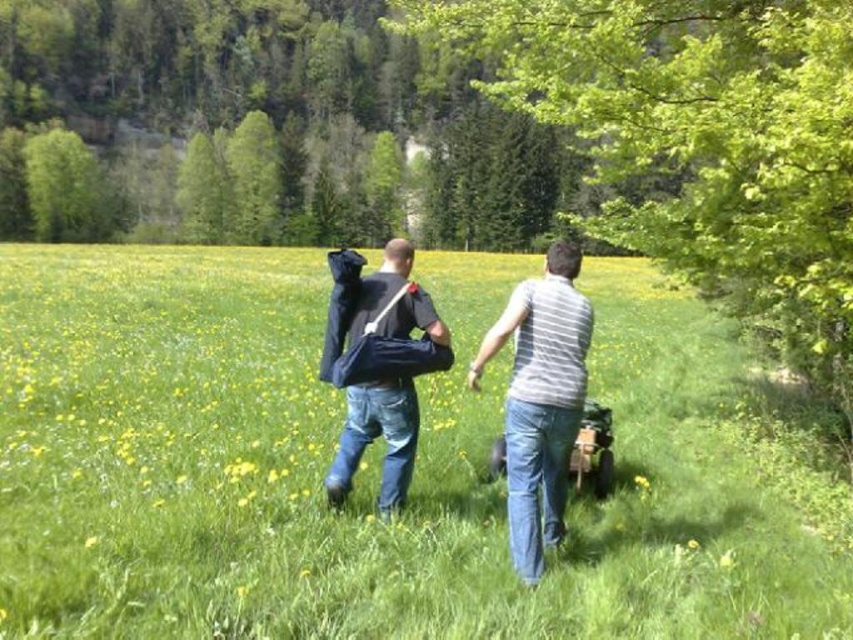
You are a drone operator trying to capture a photo of the two people in the field. You need to ensure the green grass at center and denim jeans at center are both visible in the frame. Given that your drone can capture a maximum distance of 10 meters between the closest and farthest objects in focus, will both subjects be in focus?

The green grass at center is 8.44 meters away from denim jeans at center. Since the maximum distance the drone can handle is 10 meters, both subjects will be in focus as the distance between them is within the allowable range.

You are a photographer trying to capture a photo of the green leafy tree at upper right and the denim jeans at center. Which object should you focus on first if you want to include both in the frame without moving the camera?

The green leafy tree at upper right should be focused on first because it is larger in size compared to the denim jeans at center, ensuring it fits well within the frame.